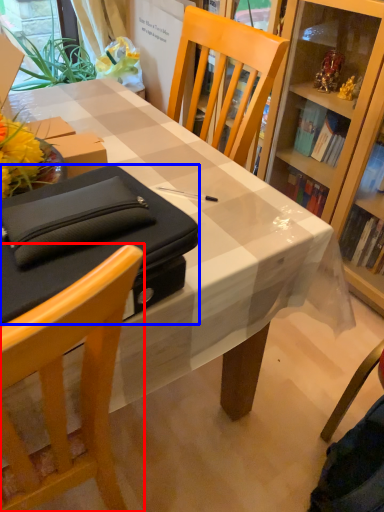
Question: Which point is closer to the camera, chair (highlighted by a red box) or box (highlighted by a blue box)?

Choices:
 (A) chair
 (B) box

Answer: (A)